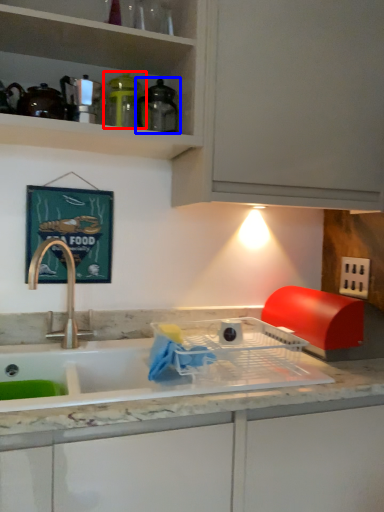
Question: Which object appears farthest to the camera in this image, appliance (highlighted by a red box) or appliance (highlighted by a blue box)?

Choices:
 (A) appliance
 (B) appliance

Answer: (A)